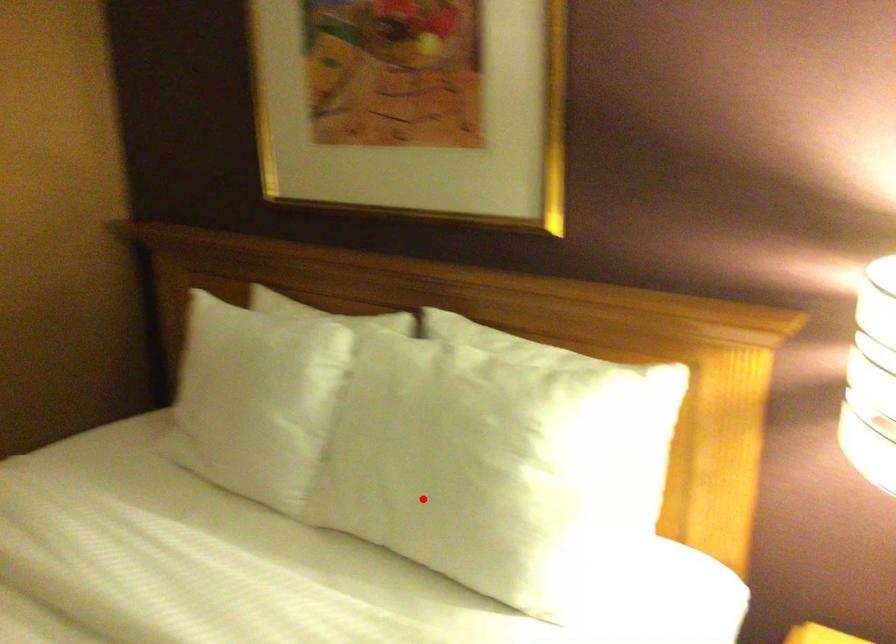
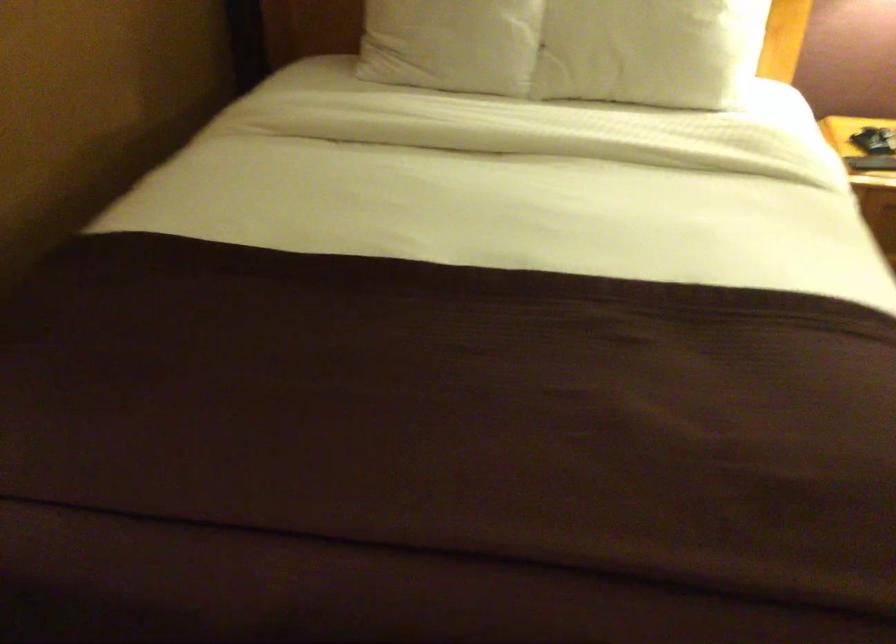
Locate, in the second image, the point that corresponds to the highlighted location in the first image.

(649, 51)